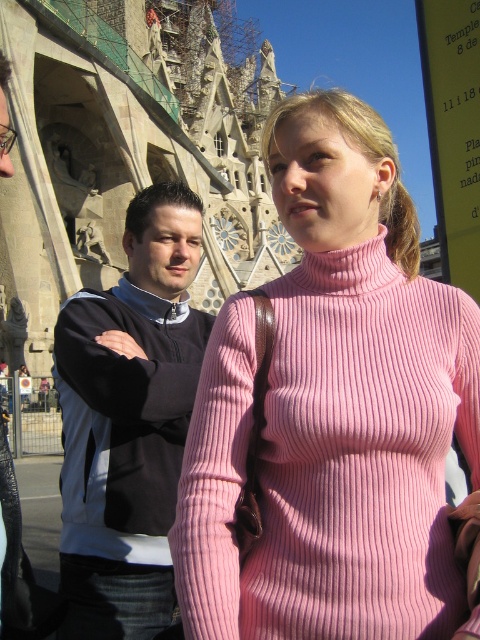
Between point (216, 324) and point (109, 442), which one is positioned in front?

Point (216, 324) is more forward.

Is point (211, 624) less distant than point (80, 561)?

Yes, it is.

This screenshot has width=480, height=640. In order to click on pink ribbed sweater at center in this screenshot , I will do `click(334, 410)`.